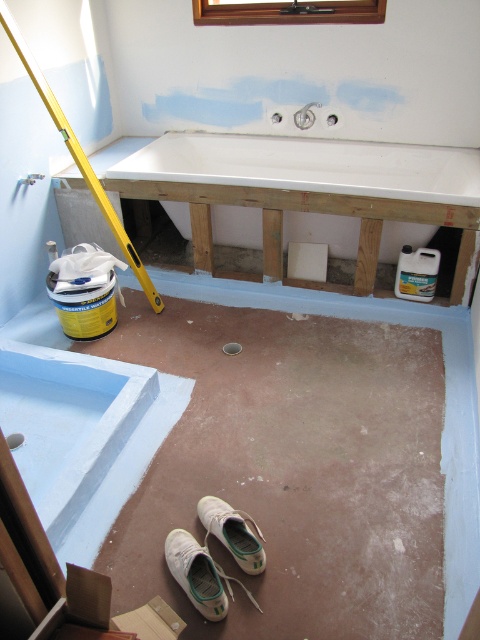
Locate an element on the screen. white glossy sink at center is located at coordinates (310, 166).

Between white glossy sink at center and white canvas shoe at lower center, which one appears on the right side from the viewer's perspective?

From the viewer's perspective, white glossy sink at center appears more on the right side.

Does point (301, 228) come behind point (168, 556)?

Yes, point (301, 228) is farther from viewer.

This screenshot has width=480, height=640. Find the location of `white glossy sink at center`. white glossy sink at center is located at coordinates (310, 166).

Is white glossy sink at center taller than white fabric shoe at lower center?

Yes.

Find the location of a particular element. Image resolution: width=480 pixels, height=640 pixels. white glossy sink at center is located at coordinates (310, 166).

Does point (241, 224) come closer to viewer compared to point (241, 548)?

No, (241, 224) is behind (241, 548).

The height and width of the screenshot is (640, 480). I want to click on white glossy sink at center, so click(310, 166).

Does white canvas shoe at lower center have a larger size compared to white fabric shoe at lower center?

No.

Locate an element on the screen. Image resolution: width=480 pixels, height=640 pixels. white canvas shoe at lower center is located at coordinates (195, 573).